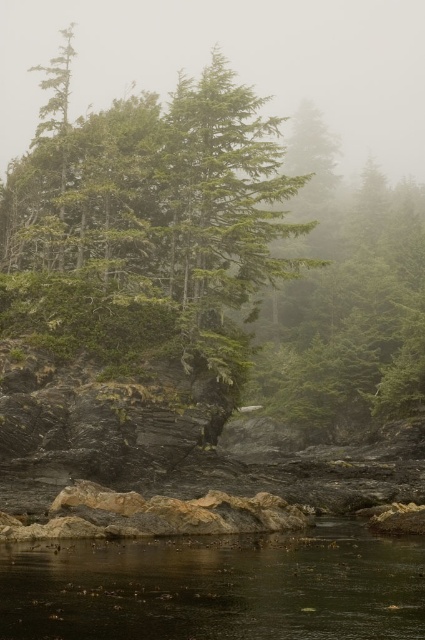
You are a hiker standing at the edge of the dark brown water at lower center. You want to reach the foggy translucent mist at upper center. Can you walk directly towards it without any obstacles?

The foggy translucent mist at upper center and dark brown water at lower center are 393.36 meters apart from each other. However, the presence of rugged, dark colored rocks in the midground and scattered debris on the water surface may obstruct your path. It is unclear if there is a clear path between them.

You are standing at the edge of the water in the coastal landscape and see two points marked in the image. Which point, point [146,164] or point [348,92], is closer to you?

Point [146,164] is closer to the viewer than point [348,92].